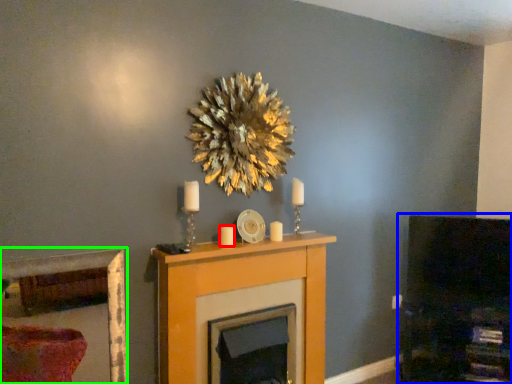
Question: Which is nearer to the candle (highlighted by a red box)? dark (highlighted by a blue box) or picture frame (highlighted by a green box).

Choices:
 (A) dark
 (B) picture frame

Answer: (A)